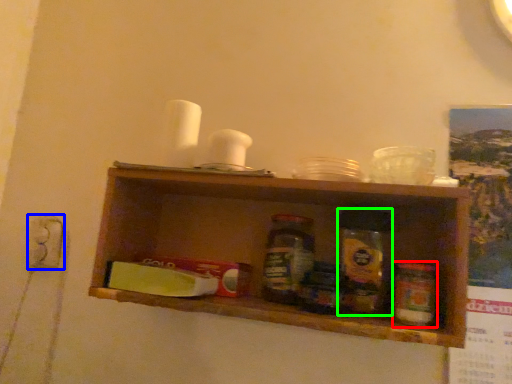
Question: Considering the real-world distances, which object is farthest from bottle (highlighted by a red box)? electric outlet (highlighted by a blue box) or glass jar (highlighted by a green box)?

Choices:
 (A) electric outlet
 (B) glass jar

Answer: (A)